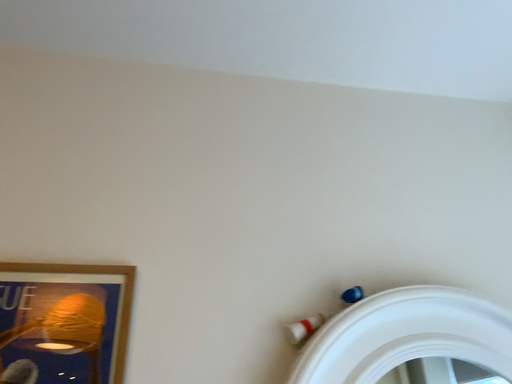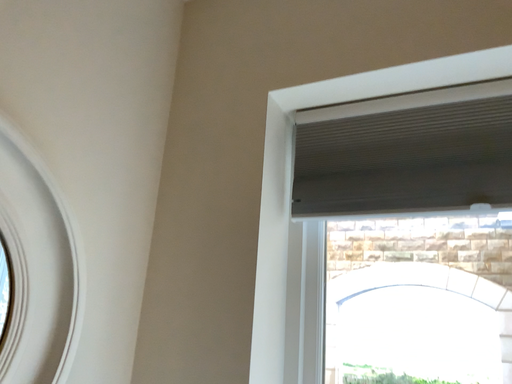
Question: How did the camera likely rotate when shooting the video?

Choices:
 (A) rotated right
 (B) rotated left

Answer: (A)